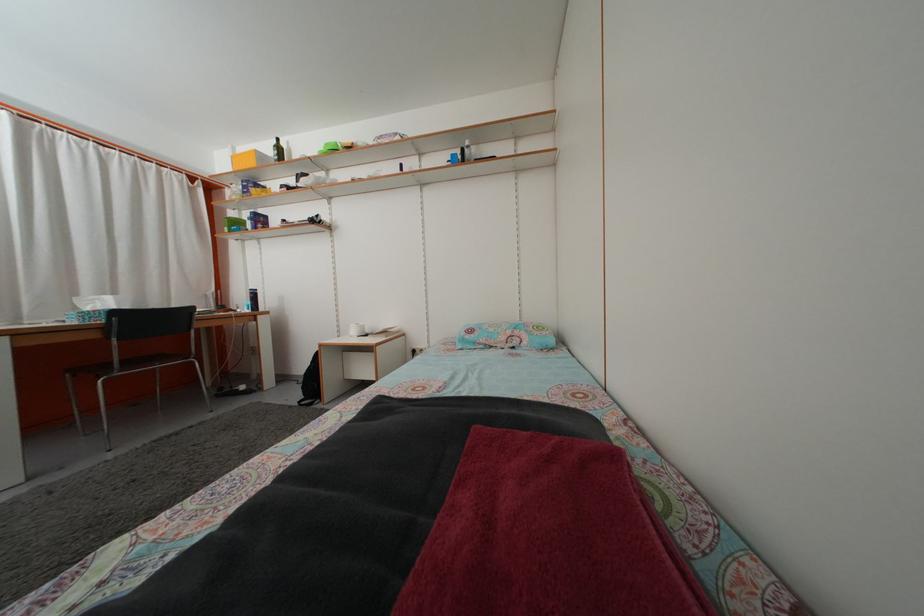
What are the coordinates of `white spray bottle` in the screenshot? It's located at (468, 151).